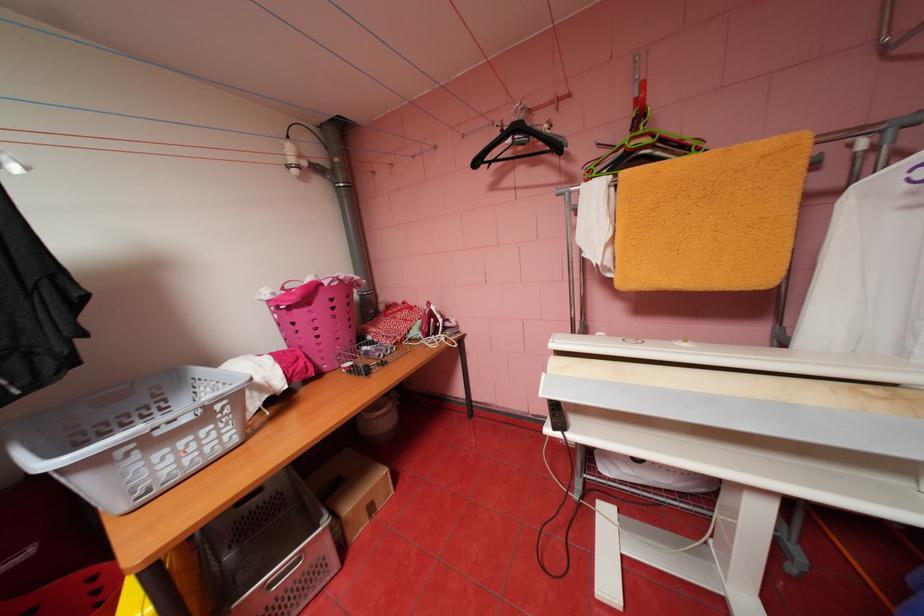
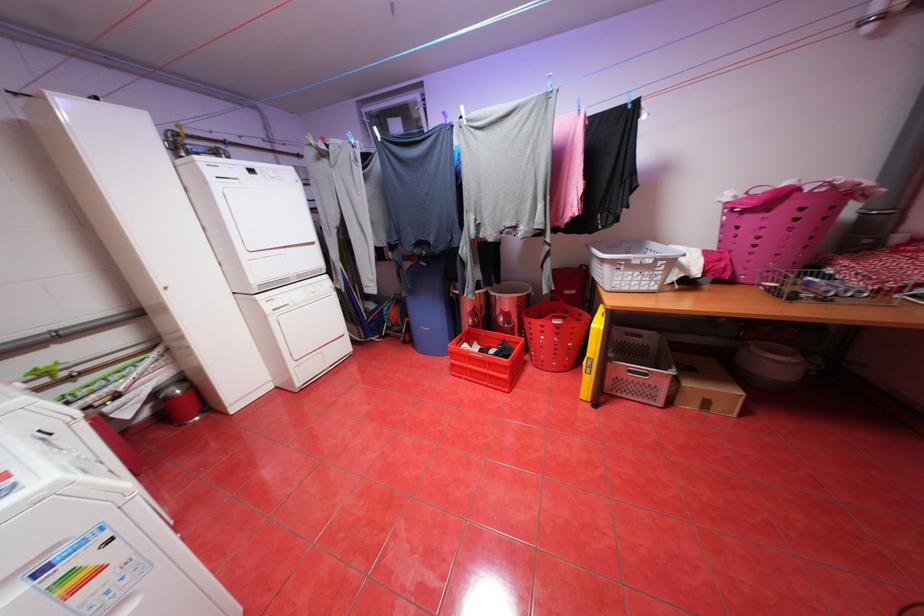
In the second image, find the point that corresponds to point (346, 278) in the first image.

(839, 183)